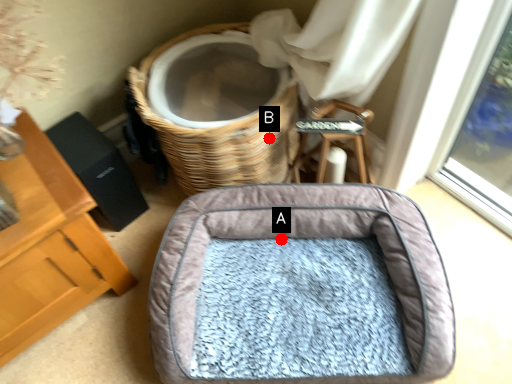
Question: Two points are circled on the image, labeled by A and B beside each circle. Among these points, which one is farthest from the camera?

Choices:
 (A) A is further
 (B) B is further

Answer: (A)